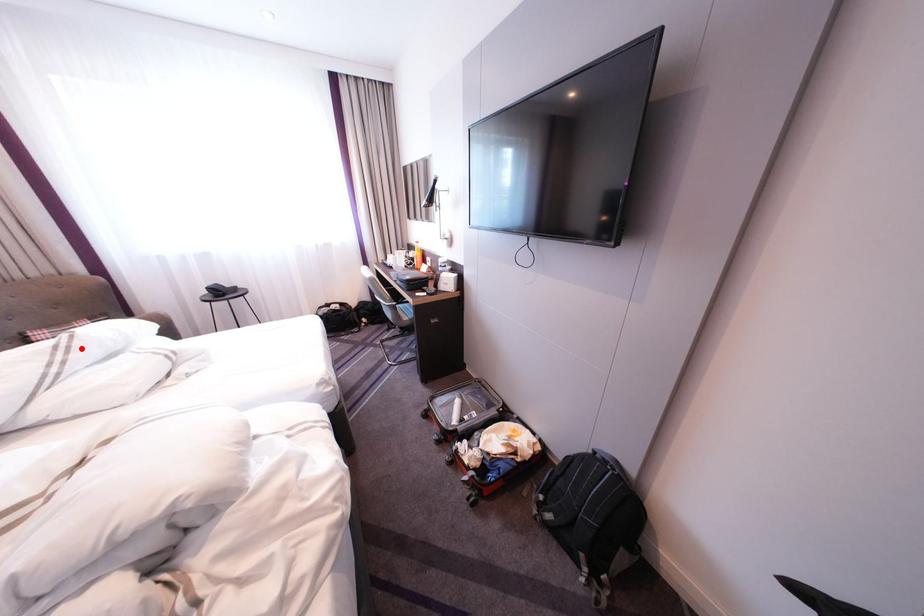
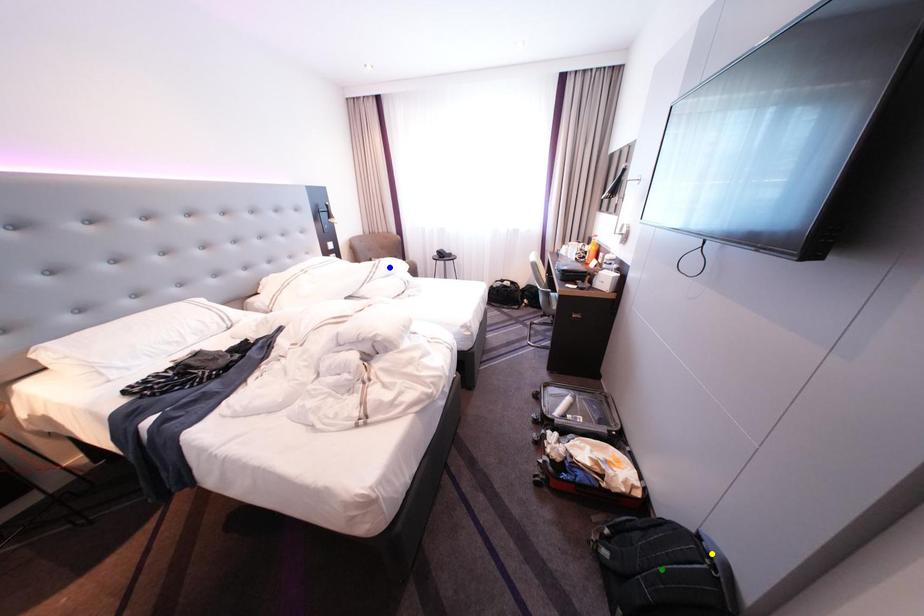
Question: I am providing you with two images of the same scene from different viewpoints. A red point is marked on the first image. You are given multiple points on the second image. In image 2, which mark is for the same physical point as the one in image 1?

Choices:
 (A) green point
 (B) blue point
 (C) yellow point

Answer: (B)